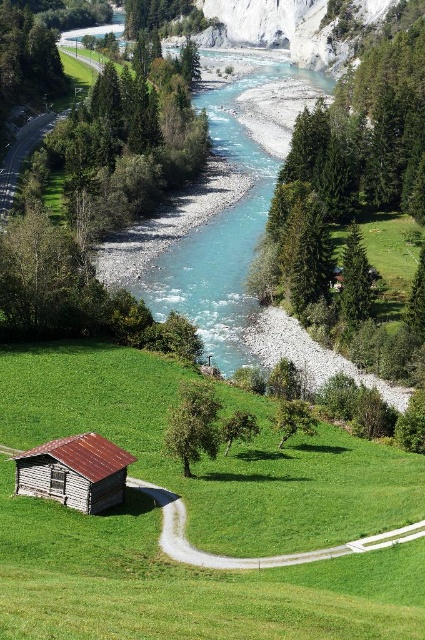
Question: Does turquoise smooth water at center appear on the right side of rustic wood cabin at lower left?

Choices:
 (A) yes
 (B) no

Answer: (A)

Question: Is turquoise smooth water at center smaller than rustic wood cabin at lower left?

Choices:
 (A) no
 (B) yes

Answer: (A)

Question: Is turquoise smooth water at center to the right of rustic wood cabin at lower left from the viewer's perspective?

Choices:
 (A) no
 (B) yes

Answer: (B)

Question: Which of the following is the closest to the observer?

Choices:
 (A) turquoise smooth water at center
 (B) rustic wood cabin at lower left

Answer: (B)